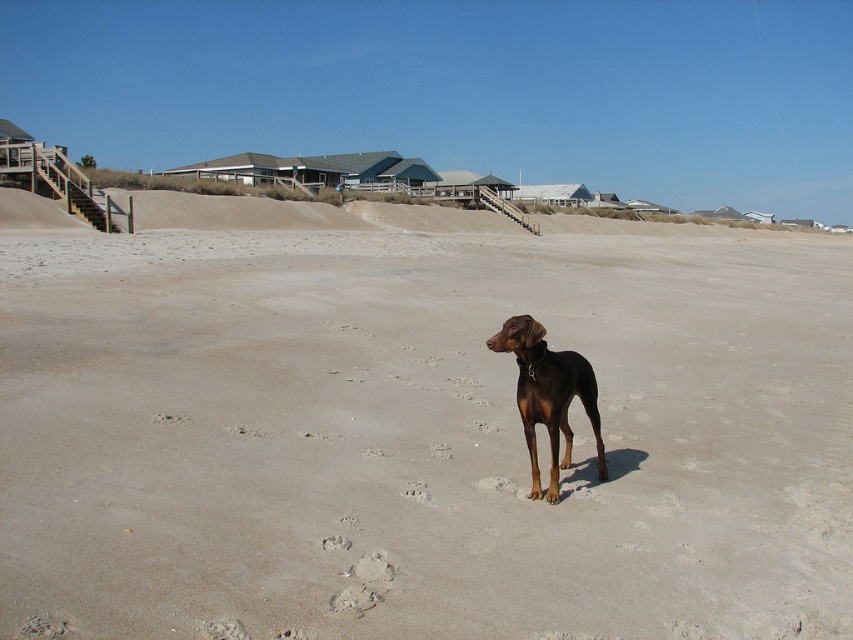
Question: Does brown sand at center come in front of brown glossy dog at center?

Choices:
 (A) no
 (B) yes

Answer: (B)

Question: Does brown sand at center appear on the right side of brown glossy dog at center?

Choices:
 (A) no
 (B) yes

Answer: (A)

Question: Is brown sand at center above brown glossy dog at center?

Choices:
 (A) yes
 (B) no

Answer: (A)

Question: Which object is closer to the camera taking this photo?

Choices:
 (A) brown glossy dog at center
 (B) brown sand at center

Answer: (B)

Question: Which object is closer to the camera taking this photo?

Choices:
 (A) brown glossy dog at center
 (B) brown sand at center

Answer: (B)